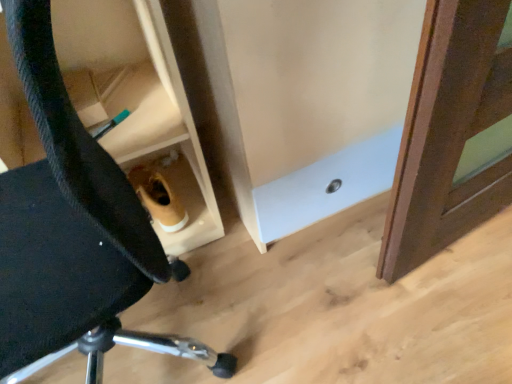
Question: From a real-world perspective, is black fabric chair at lower left above or below wooden cabinet at lower center?

Choices:
 (A) above
 (B) below

Answer: (A)

Question: Is black fabric chair at lower left to the left or to the right of wooden cabinet at lower center in the image?

Choices:
 (A) left
 (B) right

Answer: (A)

Question: Is black fabric chair at lower left situated inside wooden cabinet at lower center or outside?

Choices:
 (A) outside
 (B) inside

Answer: (A)

Question: Choose the correct answer: Is wooden cabinet at lower center inside black fabric chair at lower left or outside it?

Choices:
 (A) inside
 (B) outside

Answer: (B)

Question: Is wooden cabinet at lower center wider or thinner than black fabric chair at lower left?

Choices:
 (A) thin
 (B) wide

Answer: (A)

Question: From the image's perspective, relative to black fabric chair at lower left, is wooden cabinet at lower center above or below?

Choices:
 (A) above
 (B) below

Answer: (A)

Question: From a real-world perspective, is wooden cabinet at lower center positioned above or below black fabric chair at lower left?

Choices:
 (A) below
 (B) above

Answer: (A)